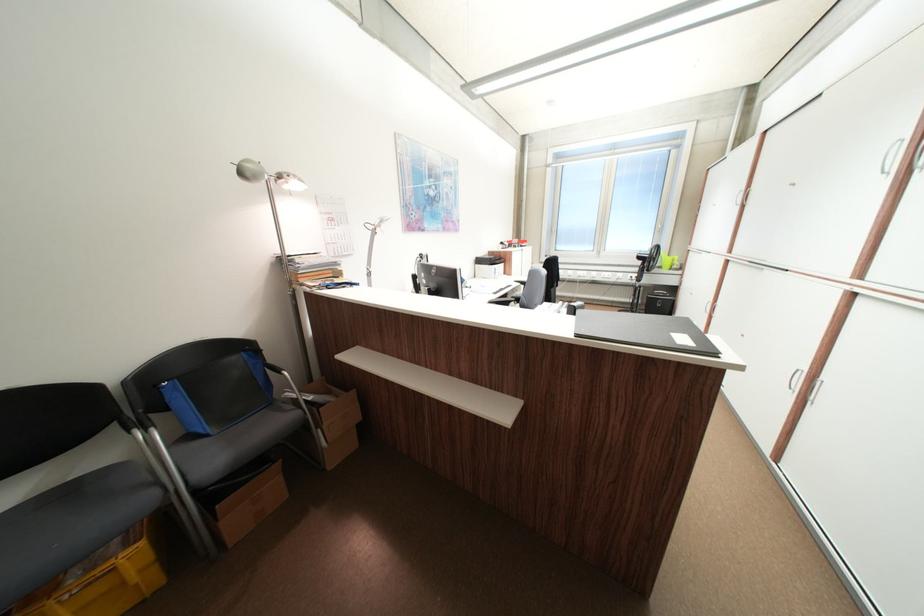
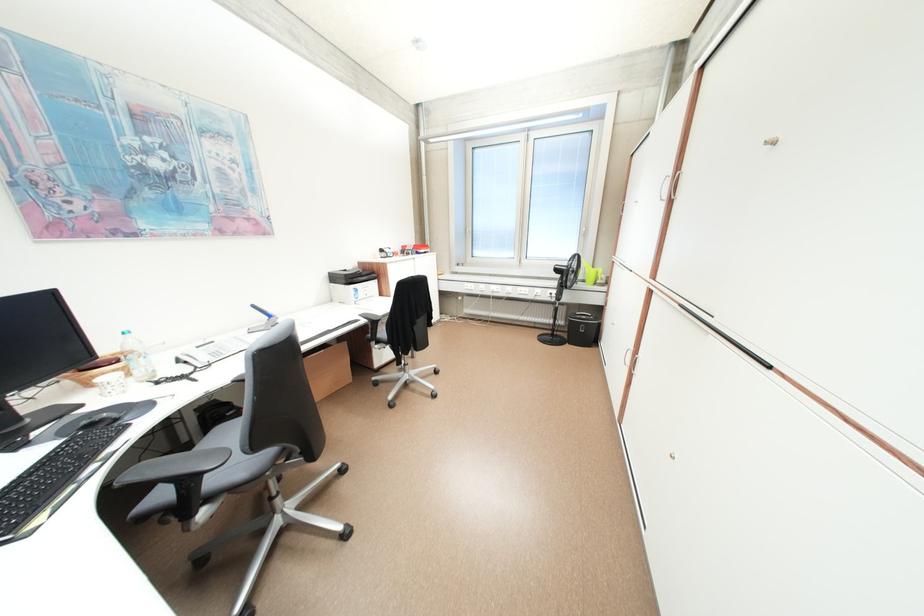
Locate, in the second image, the point that corresponds to point 675,260 in the first image.

(598, 273)